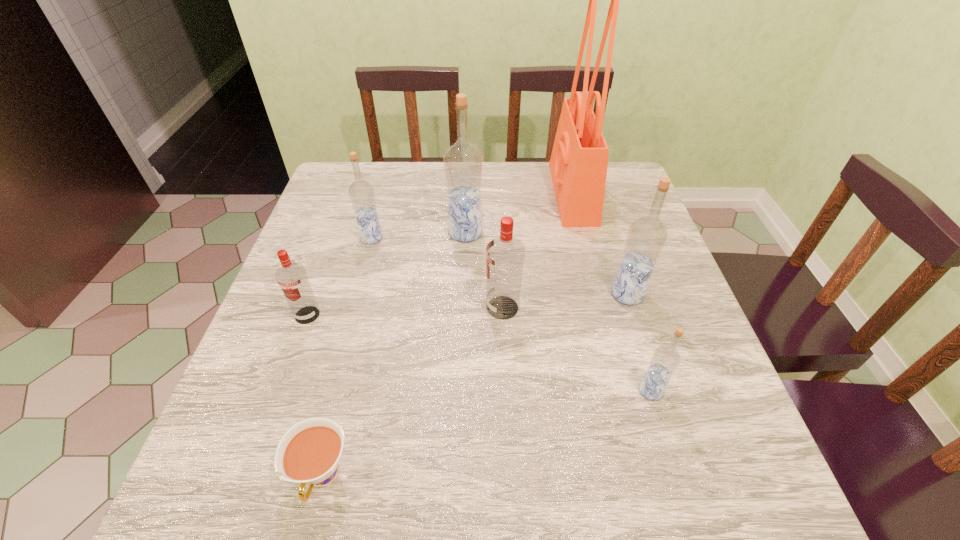
Identify the location of free space that is in between the tallest object and the third vodka from left to right. (519, 213).

Where is `free space between the fifth object from left to right and the third farthest blue vodka`? The image size is (960, 540). free space between the fifth object from left to right and the third farthest blue vodka is located at coordinates (565, 301).

Locate an element on the screen. unoccupied area between the fifth object from right to left and the leftmost vodka is located at coordinates (386, 274).

This screenshot has height=540, width=960. Find the location of `vacant space in between the fifth object from left to right and the tallest object`. vacant space in between the fifth object from left to right and the tallest object is located at coordinates (538, 251).

Locate an element on the screen. The width and height of the screenshot is (960, 540). free spot between the smallest blue vodka and the fifth shortest vodka is located at coordinates (639, 342).

This screenshot has width=960, height=540. I want to click on empty space that is in between the third smallest blue vodka and the second tallest object, so click(546, 264).

Identify which object is the fifth closest to the left red vodka. Please provide its 2D coordinates. Your answer should be formatted as a tuple, i.e. [(x, y)], where the tuple contains the x and y coordinates of a point satisfying the conditions above.

[(579, 160)]

Identify the location of object identified as the second closest to the biggest blue vodka. (505, 254).

In order to click on vodka that is the third closest to the second vodka from left to right in this screenshot , I will do `click(505, 254)`.

Choose which vodka is the nearest neighbor to the tote bag. Please provide its 2D coordinates. Your answer should be formatted as a tuple, i.e. [(x, y)], where the tuple contains the x and y coordinates of a point satisfying the conditions above.

[(646, 238)]